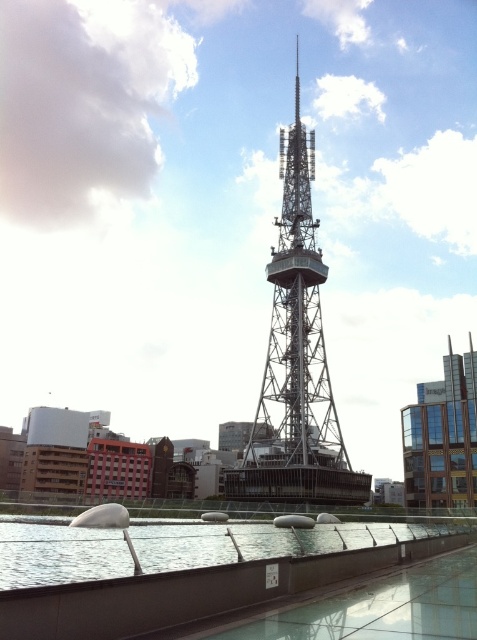
Question: Which object is closer to the camera taking this photo?

Choices:
 (A) metallic lattice tower at center
 (B) clear glass water at lower center

Answer: (B)

Question: Can you confirm if metallic lattice tower at center is smaller than clear glass water at lower center?

Choices:
 (A) no
 (B) yes

Answer: (A)

Question: Observing the image, what is the correct spatial positioning of metallic lattice tower at center in reference to clear glass water at lower center?

Choices:
 (A) right
 (B) left

Answer: (A)

Question: Among these points, which one is nearest to the camera?

Choices:
 (A) (269, 380)
 (B) (60, 547)

Answer: (B)

Question: Can you confirm if metallic lattice tower at center is smaller than clear glass water at lower center?

Choices:
 (A) yes
 (B) no

Answer: (B)